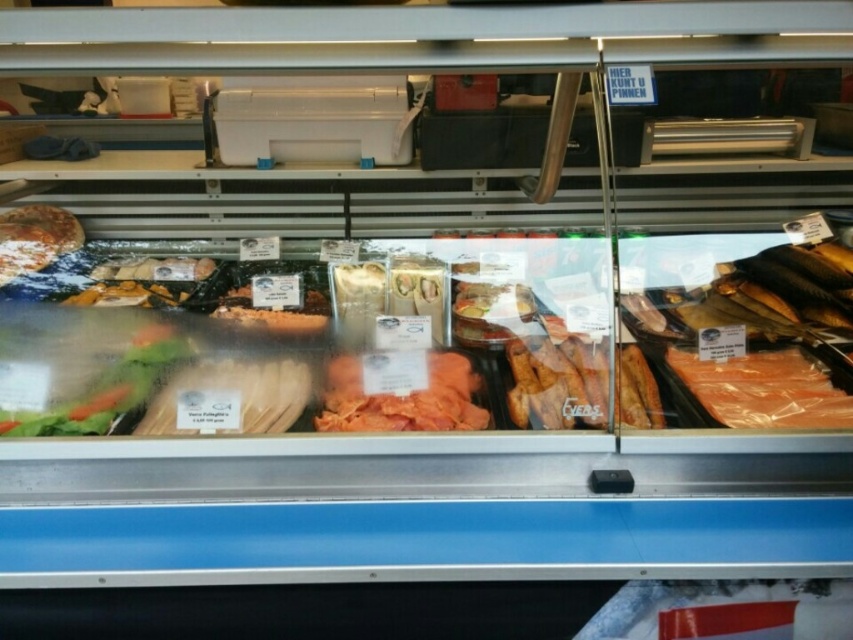
You are a customer in the grocery store looking at the refrigerated display case. You see two points marked in the case. Which point is closer to you, point (761, 388) or point (57, 234)?

Point (761, 388) is in front of point (57, 234), so it is closer to you.

You are a customer at the grocery store and want to grab both the pink translucent salmon at right and the pinkish matte salmon at center from the refrigerated display case. Which salmon should you reach for first to get the one that is closer to you?

The pink translucent salmon at right is closer to the viewer than the pinkish matte salmon at center, so you should reach for the pink translucent salmon at right first.

What are the coordinates of the pink translucent salmon at right?

The coordinates of the pink translucent salmon at right are at point (763, 388).